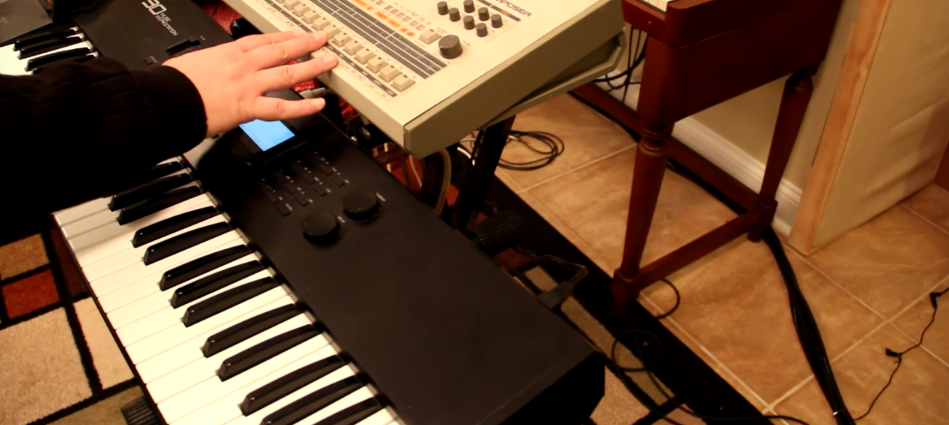
At what (x,y) coordinates should I click in order to perform the action: click on keyboard. Please return your answer as a coordinate pair (x, y). Image resolution: width=949 pixels, height=425 pixels. Looking at the image, I should click on (338, 272).